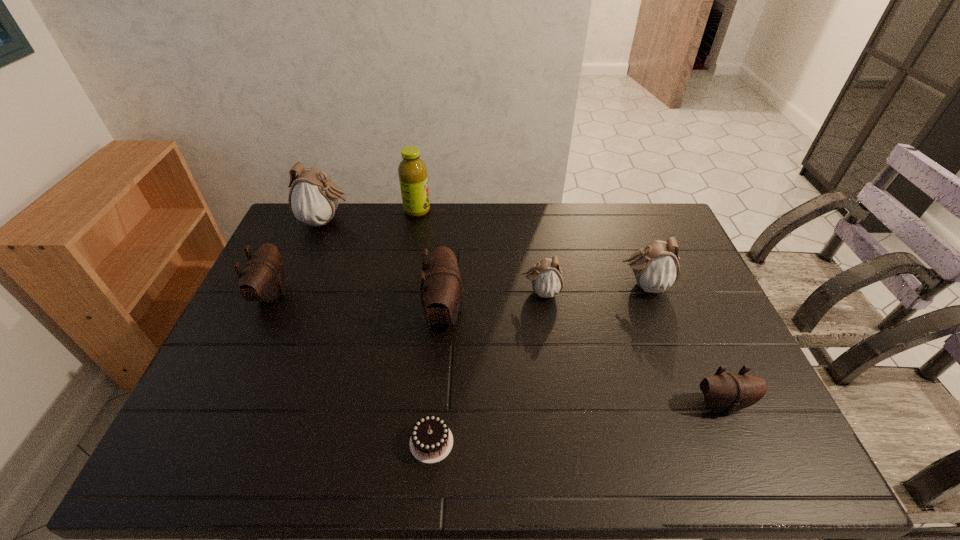
This screenshot has width=960, height=540. I want to click on the closest white pouch to the second brown pouch from right to left, so click(546, 276).

The width and height of the screenshot is (960, 540). Identify the location of brown pouch that stands as the third closest to the second biggest white pouch. (262, 279).

Identify the location of brown pouch that is the closest one to the fruit juice. (441, 284).